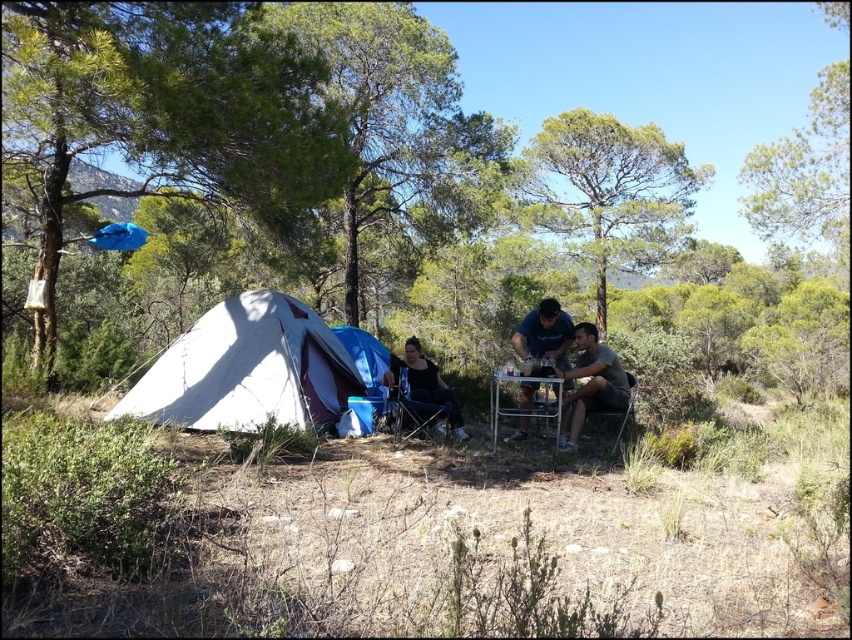
Does green leafy tree at left appear on the left side of blue fabric chair at center?

Indeed, green leafy tree at left is positioned on the left side of blue fabric chair at center.

Who is lower down, green leafy tree at left or blue fabric chair at center?

blue fabric chair at center is lower down.

Which is behind, point (235, 8) or point (521, 349)?

Point (521, 349)

The height and width of the screenshot is (640, 852). I want to click on green leafy tree at left, so click(x=163, y=113).

Which is more to the left, white fabric tent at center or green leafy tree at center?

Positioned to the left is white fabric tent at center.

Is white fabric tent at center to the right of green leafy tree at center from the viewer's perspective?

No, white fabric tent at center is not to the right of green leafy tree at center.

Is point (274, 330) positioned before point (617, 228)?

Yes, point (274, 330) is in front of point (617, 228).

At what (x,y) coordinates should I click in order to perform the action: click on white fabric tent at center. Please return your answer as a coordinate pair (x, y). This screenshot has height=640, width=852. Looking at the image, I should click on (248, 369).

Is green fabric chair at center above metallic silver table at center?

Yes, green fabric chair at center is above metallic silver table at center.

Does green fabric chair at center appear under metallic silver table at center?

No.

Find the location of a particular element. green fabric chair at center is located at coordinates (591, 381).

The height and width of the screenshot is (640, 852). Find the location of `green fabric chair at center`. green fabric chair at center is located at coordinates (591, 381).